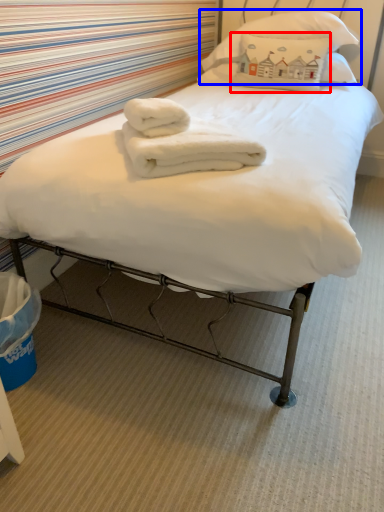
Question: Which object appears farthest to the camera in this image, pillow (highlighted by a red box) or pillow (highlighted by a blue box)?

Choices:
 (A) pillow
 (B) pillow

Answer: (A)